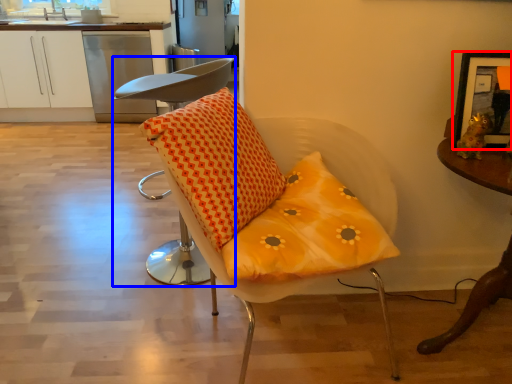
Question: Which point is closer to the camera, picture frame (highlighted by a red box) or chair (highlighted by a blue box)?

Choices:
 (A) picture frame
 (B) chair

Answer: (A)